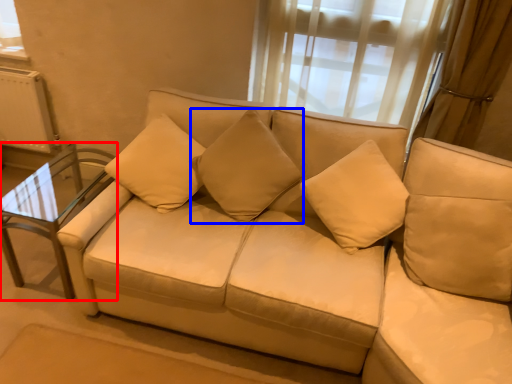
Question: Among these objects, which one is farthest to the camera, table (highlighted by a red box) or pillow (highlighted by a blue box)?

Choices:
 (A) table
 (B) pillow

Answer: (A)